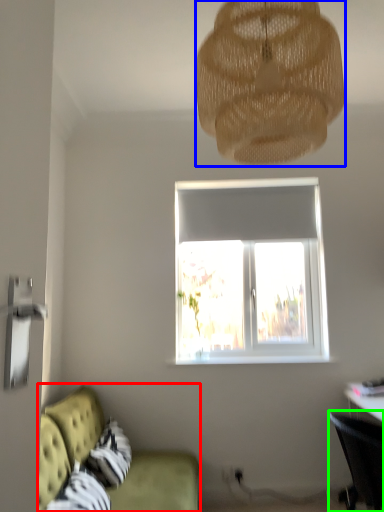
Question: Which object is the farthest from studio couch (highlighted by a red box)? Choose among these: lamp (highlighted by a blue box) or chair (highlighted by a green box).

Choices:
 (A) lamp
 (B) chair

Answer: (A)